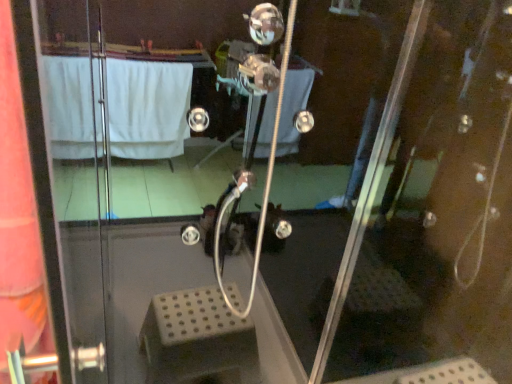
This screenshot has width=512, height=384. What do you see at coordinates (18, 215) in the screenshot?
I see `white fabric curtain at left` at bounding box center [18, 215].

You are a GUI agent. You are given a task and a screenshot of the screen. Output one action in this format:
    pyautogui.click(x=<x>, y=<y>)
    Task: Click on the white fabric curtain at left
    This screenshot has width=512, height=384.
    Given the screenshot: What is the action you would take?
    pyautogui.click(x=18, y=215)

In order to face white fabric curtain at left, should I rotate leftwards or rightwards?

To align with it, rotate left about 30.114°.

This screenshot has height=384, width=512. In order to click on white fabric curtain at left in this screenshot , I will do `click(18, 215)`.